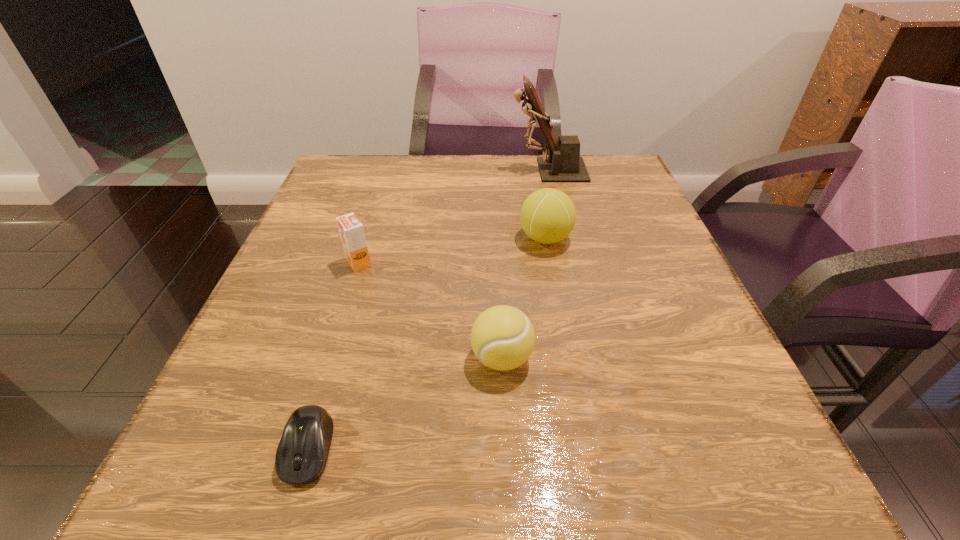
Where is `the tallest object`? The height and width of the screenshot is (540, 960). the tallest object is located at coordinates (563, 164).

Locate an element on the screen. Image resolution: width=960 pixels, height=540 pixels. figurine is located at coordinates (563, 164).

At what (x,y) coordinates should I click in order to perform the action: click on the farther tennis ball. Please return your answer as a coordinate pair (x, y). The width and height of the screenshot is (960, 540). Looking at the image, I should click on (548, 215).

Identify the location of orange juice. The image size is (960, 540). (351, 230).

The height and width of the screenshot is (540, 960). In order to click on the nearer tennis ball in this screenshot , I will do [502, 337].

What are the coordinates of `mouse` in the screenshot? It's located at (303, 449).

The height and width of the screenshot is (540, 960). I want to click on the nearest object, so click(x=303, y=449).

Find the location of `vacant region located on the front-facing side of the farthest object`. vacant region located on the front-facing side of the farthest object is located at coordinates (362, 170).

Identify the location of vacant area located on the front-facing side of the farthest object. This screenshot has height=540, width=960. (447, 170).

This screenshot has width=960, height=540. Find the location of `free space located on the front-facing side of the farthest object`. free space located on the front-facing side of the farthest object is located at coordinates (463, 170).